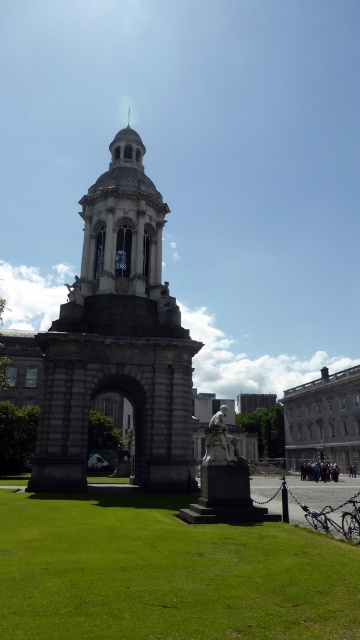
Who is more forward, (x=83, y=228) or (x=230, y=440)?

Point (x=230, y=440) is in front.

Does gray stone tower at center have a greater width compared to white marble statue at lower center?

Correct, the width of gray stone tower at center exceeds that of white marble statue at lower center.

Find the location of `gray stone tower at center`. gray stone tower at center is located at coordinates (118, 337).

Identify the location of gray stone tower at center. This screenshot has height=640, width=360. (118, 337).

Who is more forward, (69, 456) or (204, 451)?

Point (69, 456) is more forward.

Between gray stone tower at center and white marble statue at center, which one appears on the left side from the viewer's perspective?

From the viewer's perspective, gray stone tower at center appears more on the left side.

Between point (131, 230) and point (230, 448), which one is positioned in front?

Point (230, 448) is in front.

Locate an element on the screen. This screenshot has height=640, width=360. gray stone tower at center is located at coordinates (118, 337).

You are a GUI agent. You are given a task and a screenshot of the screen. Output one action in this format:
    pyautogui.click(x=<x>, y=<y>)
    Task: Click on the green grass at center
    
    Given the screenshot: What is the action you would take?
    pyautogui.click(x=165, y=573)

Does green grass at center have a larger size compared to white marble statue at center?

No, green grass at center is not bigger than white marble statue at center.

Does point (304, 589) come farther from viewer compared to point (222, 448)?

No, (304, 589) is in front of (222, 448).

This screenshot has height=640, width=360. What are the coordinates of `green grass at center` in the screenshot? It's located at (165, 573).